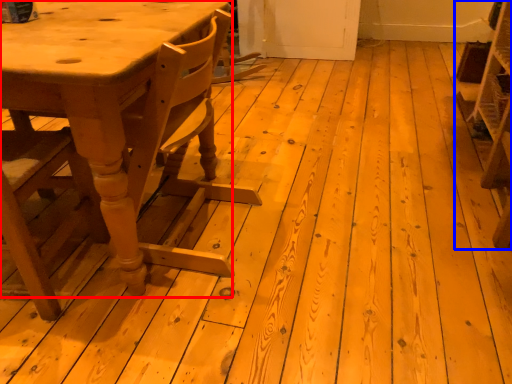
Question: Which object appears farthest to the camera in this image, table (highlighted by a red box) or shelf (highlighted by a blue box)?

Choices:
 (A) table
 (B) shelf

Answer: (B)